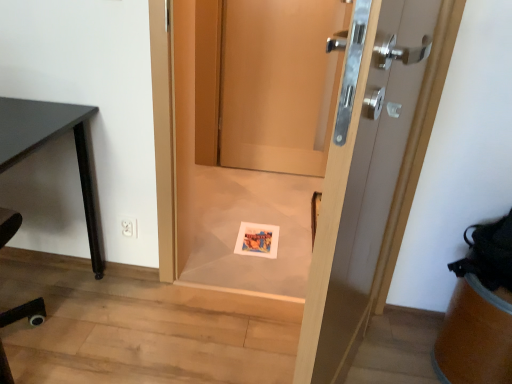
Question: Is wooden door at center, the first door in the back-to-front sequence, located within white plastic electric outlet at lower left?

Choices:
 (A) yes
 (B) no

Answer: (B)

Question: Considering the relative positions of white plastic electric outlet at lower left and wooden door at center, the third door positioned from the front, in the image provided, is white plastic electric outlet at lower left to the left of wooden door at center, the third door positioned from the front, from the viewer's perspective?

Choices:
 (A) no
 (B) yes

Answer: (B)

Question: Is white plastic electric outlet at lower left placed right next to wooden door at center, the first door in the back-to-front sequence?

Choices:
 (A) no
 (B) yes

Answer: (A)

Question: From a real-world perspective, is white plastic electric outlet at lower left under wooden door at center, the first door in the back-to-front sequence?

Choices:
 (A) yes
 (B) no

Answer: (A)

Question: From a real-world perspective, is white plastic electric outlet at lower left physically above wooden door at center, the third door positioned from the front?

Choices:
 (A) no
 (B) yes

Answer: (A)

Question: Is matte wood door at center, the 1th door when ordered from front to back, inside or outside of matte paper postcard at center?

Choices:
 (A) outside
 (B) inside

Answer: (A)

Question: Considering the positions of matte wood door at center, acting as the third door starting from the back, and matte paper postcard at center in the image, is matte wood door at center, acting as the third door starting from the back, taller or shorter than matte paper postcard at center?

Choices:
 (A) tall
 (B) short

Answer: (A)

Question: From a real-world perspective, is matte wood door at center, the 1th door when ordered from front to back, above or below matte paper postcard at center?

Choices:
 (A) above
 (B) below

Answer: (A)

Question: From the image's perspective, is matte wood door at center, acting as the third door starting from the back, located above or below matte paper postcard at center?

Choices:
 (A) above
 (B) below

Answer: (A)

Question: Do you think matte black desk at left is within matte paper postcard at center, or outside of it?

Choices:
 (A) outside
 (B) inside

Answer: (A)

Question: Considering the relative positions of matte black desk at left and matte paper postcard at center in the image provided, is matte black desk at left to the left or to the right of matte paper postcard at center?

Choices:
 (A) left
 (B) right

Answer: (A)

Question: Is point (13, 127) closer or farther from the camera than point (265, 240)?

Choices:
 (A) farther
 (B) closer

Answer: (B)

Question: Considering the positions of matte black desk at left and matte paper postcard at center in the image, is matte black desk at left bigger or smaller than matte paper postcard at center?

Choices:
 (A) big
 (B) small

Answer: (A)

Question: Is wooden door at center, the third door positioned from the front, inside the boundaries of matte wood door at center, the 1th door when ordered from front to back, or outside?

Choices:
 (A) inside
 (B) outside

Answer: (B)

Question: Is wooden door at center, the first door in the back-to-front sequence, taller or shorter than matte wood door at center, the 1th door when ordered from front to back?

Choices:
 (A) short
 (B) tall

Answer: (A)